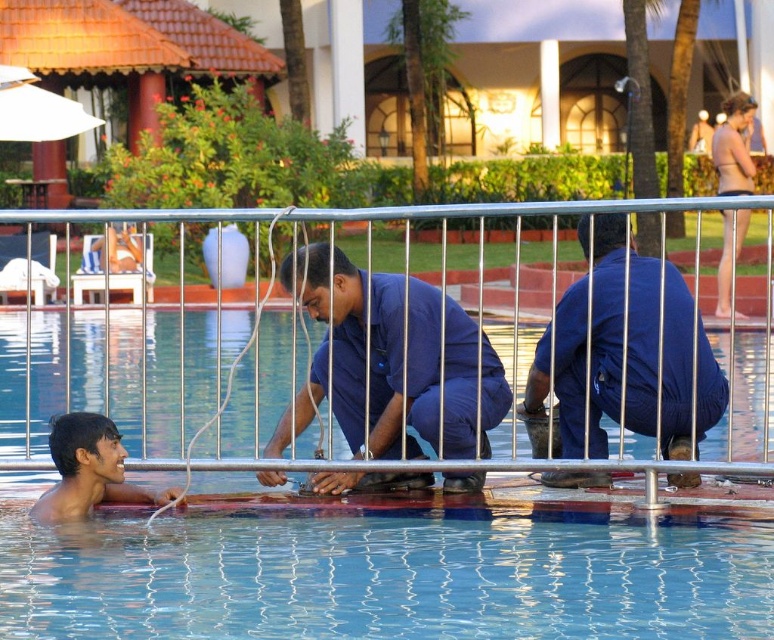
You are a lifeguard on duty and need to quickly identify which object is thinner between the blue fabric pants at lower right and the smooth skin face at lower left. Based on the scene, which one is thinner?

The blue fabric pants at lower right is thinner than the smooth skin face at lower left according to the description.